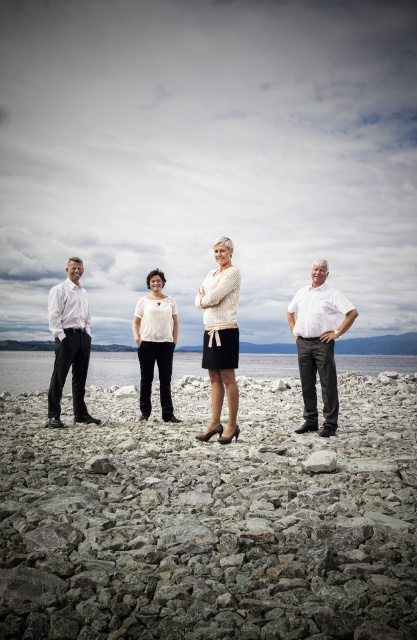
Question: Is matte white shirt at left further to camera compared to white matte blouse at center?

Choices:
 (A) no
 (B) yes

Answer: (A)

Question: Does white knit sweater at center appear on the left side of gray rock at center?

Choices:
 (A) yes
 (B) no

Answer: (A)

Question: Which of these objects is positioned farthest from the gray gravel at center?

Choices:
 (A) white matte shirt at right
 (B) white knit sweater at center

Answer: (B)

Question: Which point is farther from the camera taking this photo?

Choices:
 (A) (173, 324)
 (B) (226, 324)
 (C) (319, 452)
 (D) (65, 349)

Answer: (A)

Question: Can you confirm if gray gravel at center is wider than white matte blouse at center?

Choices:
 (A) yes
 (B) no

Answer: (A)

Question: Which point is closer to the camera?

Choices:
 (A) (67, 342)
 (B) (223, 317)

Answer: (B)